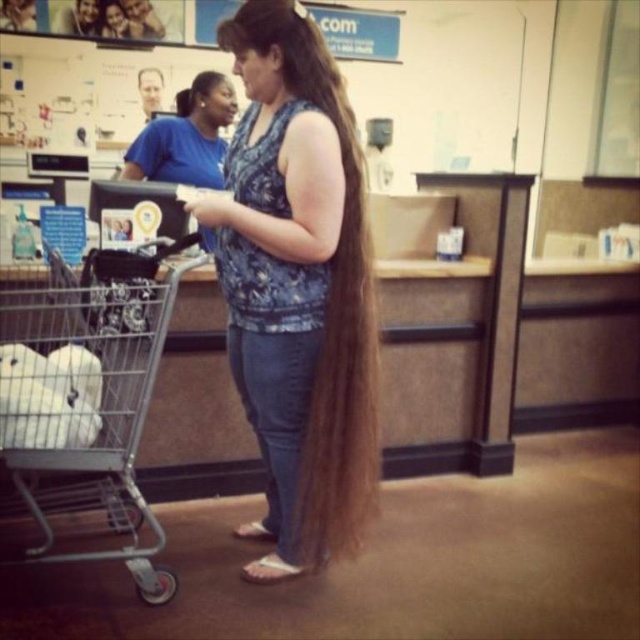
Is point (100, 433) positioned before point (177, 97)?

Yes, point (100, 433) is closer to viewer.

Which of these two, silver wire shopping cart at left or blue fabric shirt at center, stands taller?

With more height is silver wire shopping cart at left.

Is point (33, 499) more distant than point (188, 154)?

No, (33, 499) is in front of (188, 154).

This screenshot has width=640, height=640. I want to click on silver wire shopping cart at left, so click(x=88, y=394).

Is blue printed tank top at center closer to camera compared to silver wire shopping cart at left?

No, blue printed tank top at center is further to the viewer.

Who is more distant from viewer, (x=252, y=403) or (x=108, y=465)?

Point (x=252, y=403)

Image resolution: width=640 pixels, height=640 pixels. Describe the element at coordinates (298, 289) in the screenshot. I see `blue printed tank top at center` at that location.

Locate an element on the screen. blue printed tank top at center is located at coordinates (298, 289).

Which is more to the left, blue fabric shirt at center or brown silky hair at center?

Positioned to the left is blue fabric shirt at center.

Can you confirm if blue fabric shirt at center is positioned above brown silky hair at center?

Actually, blue fabric shirt at center is below brown silky hair at center.

Identify the location of blue fabric shirt at center. This screenshot has width=640, height=640. (186, 136).